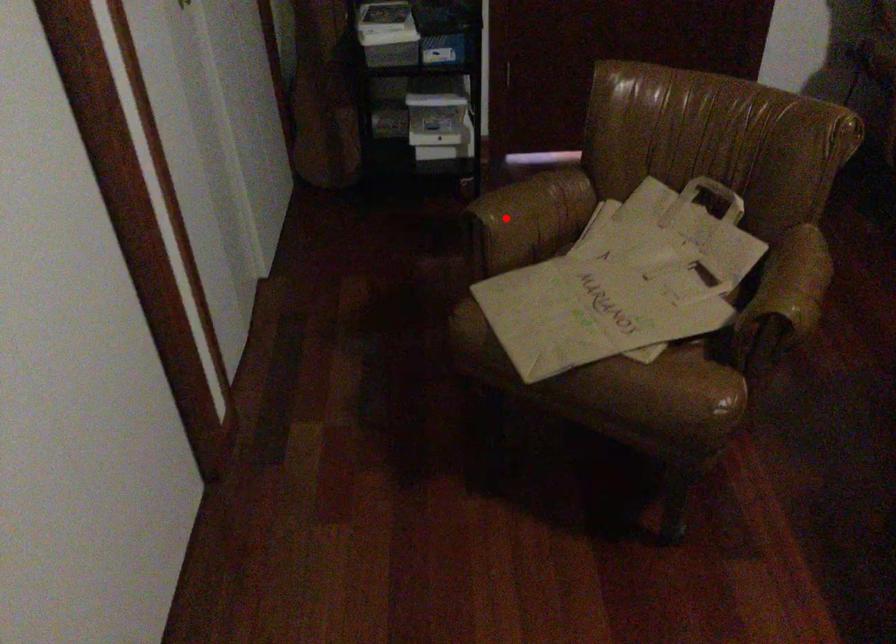
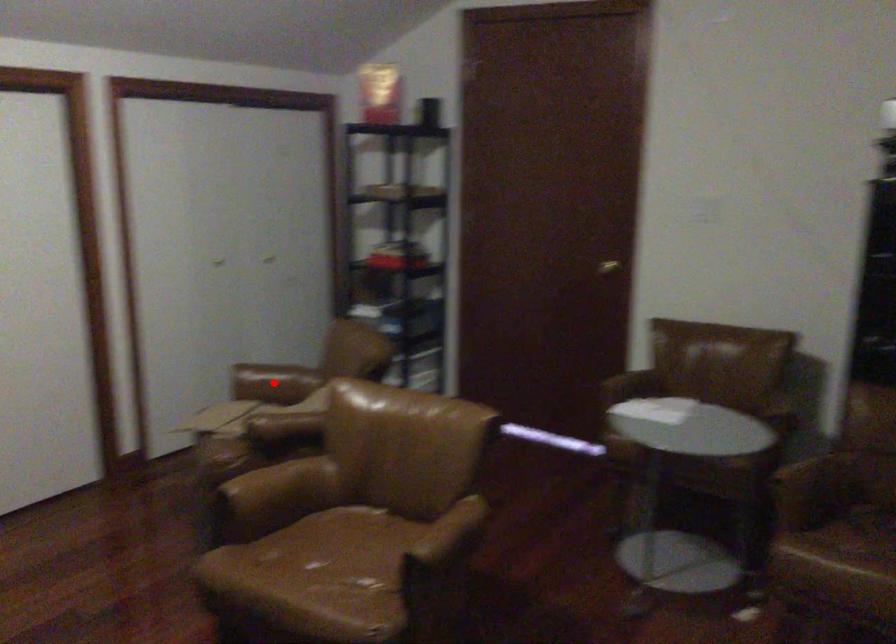
I am providing you with two images of the same scene from different viewpoints. A red point is marked on the first image and another point is marked on the second image. Are the points marked in image1 and image2 representing the same 3D position?

Yes